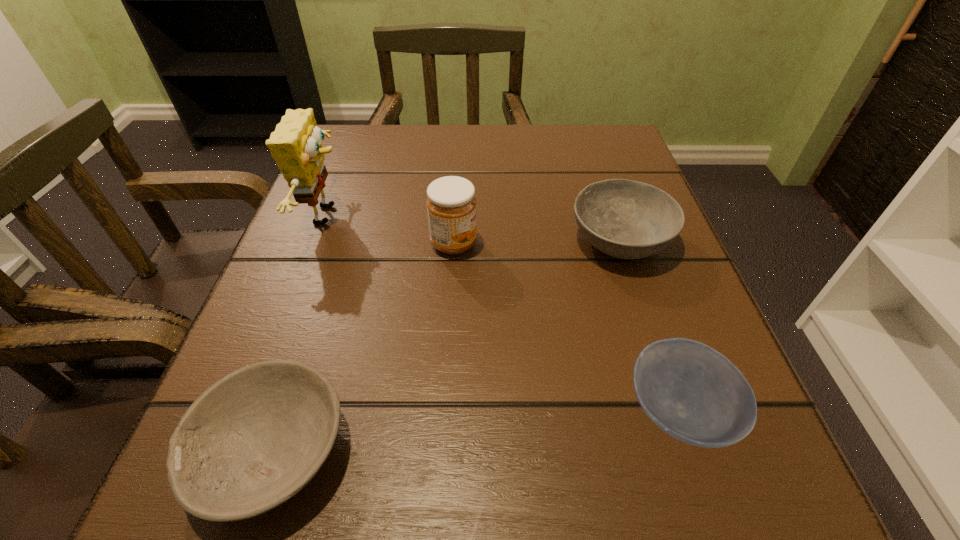
The height and width of the screenshot is (540, 960). Find the location of `sponge that is at the left edge`. sponge that is at the left edge is located at coordinates (296, 144).

Where is `bowl that is at the left edge`? The image size is (960, 540). bowl that is at the left edge is located at coordinates (251, 441).

You are a GUI agent. You are given a task and a screenshot of the screen. Output one action in this format:
    pyautogui.click(x=<x>, y=<y>)
    Task: Click on the object at the far left corner
    The height and width of the screenshot is (540, 960).
    Given the screenshot: What is the action you would take?
    pyautogui.click(x=296, y=144)

The height and width of the screenshot is (540, 960). What are the coordinates of `object that is at the near left corner` in the screenshot? It's located at (251, 441).

Where is `object that is at the near right corner`? The width and height of the screenshot is (960, 540). object that is at the near right corner is located at coordinates (694, 393).

In the image, there is a desktop. At what (x,y) coordinates should I click in order to perform the action: click on vacant region at the far edge. Please return your answer as a coordinate pair (x, y). Looking at the image, I should click on (550, 138).

This screenshot has height=540, width=960. Identify the location of vacant space at the left edge. (270, 327).

In the image, there is a desktop. Identify the location of blank space at the right edge. This screenshot has height=540, width=960. (604, 262).

Identify the location of free location at the far left corner. (377, 131).

At what (x,y) coordinates should I click in order to perform the action: click on vacant space at the far right corner. Please return your answer as a coordinate pair (x, y). Looking at the image, I should click on (634, 159).